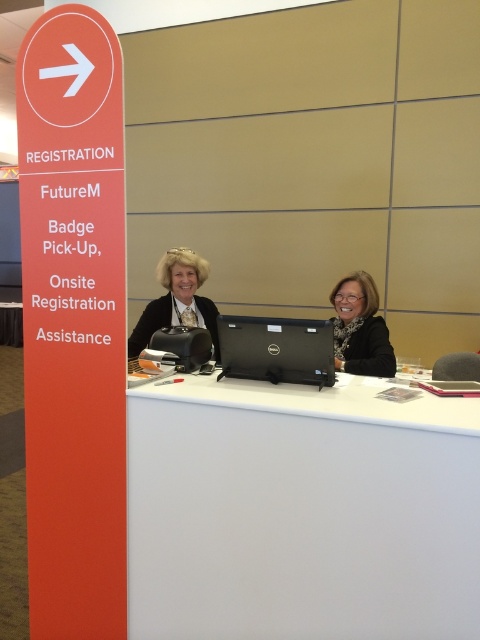
You are an attendee at the conference and need to check in. You see the white plastic desk at center and the matte black laptop at center. Which object is closer to the floor?

The white plastic desk at center is located below the matte black laptop at center, so the white plastic desk at center is closer to the floor.

You are an attendee at the event and need to check in. You see two laptops at the registration desk. Which one is closer to you, the black matte laptop at center or the matte black laptop at center?

The black matte laptop at center is closer to you than the matte black laptop at center.

You are an attendee at the conference. You see the black matte laptop at center and the matte black glasses at center on the counter. Which object is closer to the edge of the counter?

The black matte laptop at center is below the matte black glasses at center, so the laptop is lower and closer to the edge of the counter than the glasses.